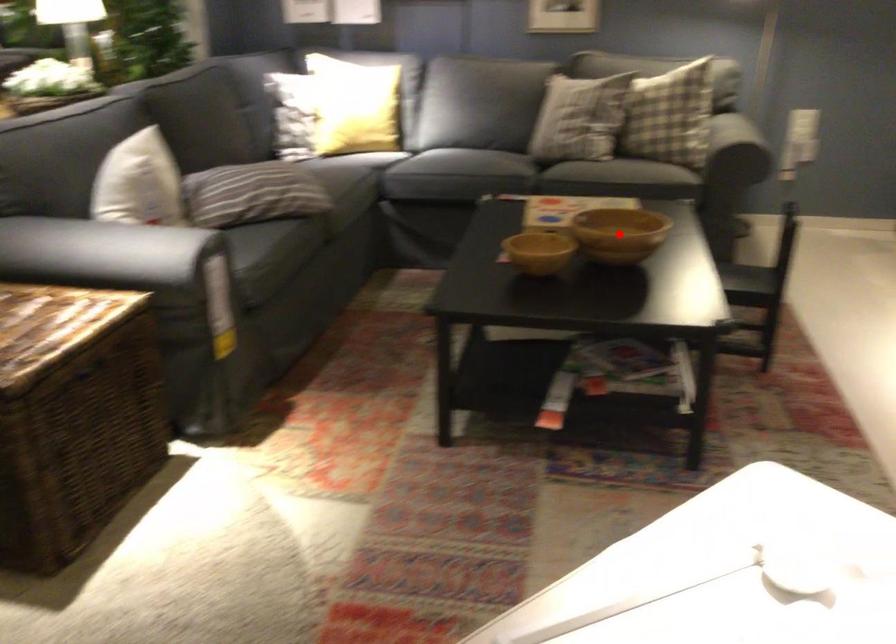
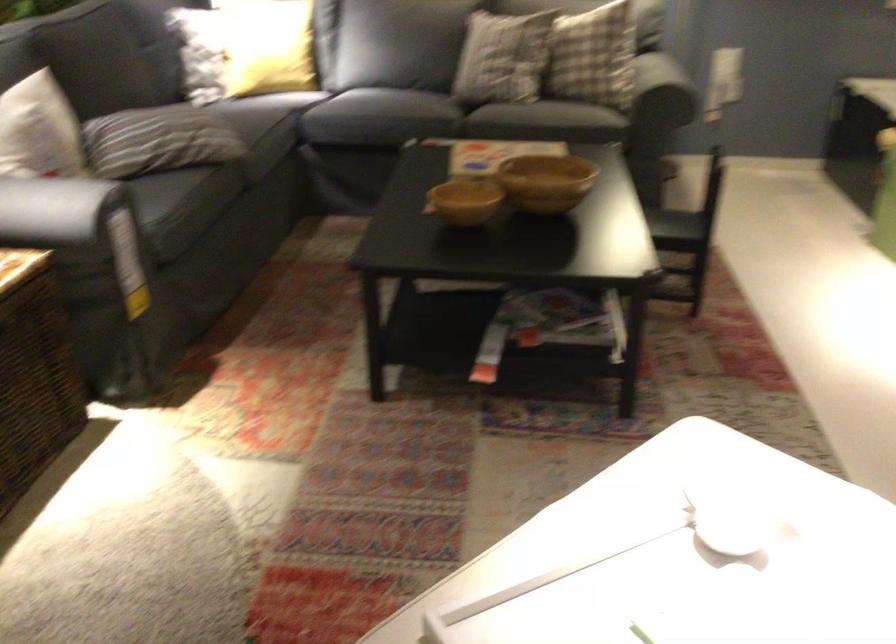
Question: I am providing you with two images of the same scene from different viewpoints. A red point is marked on the first image. At the location where the point appears in image 1, is it still visible in image 2?

Choices:
 (A) Yes
 (B) No

Answer: (B)